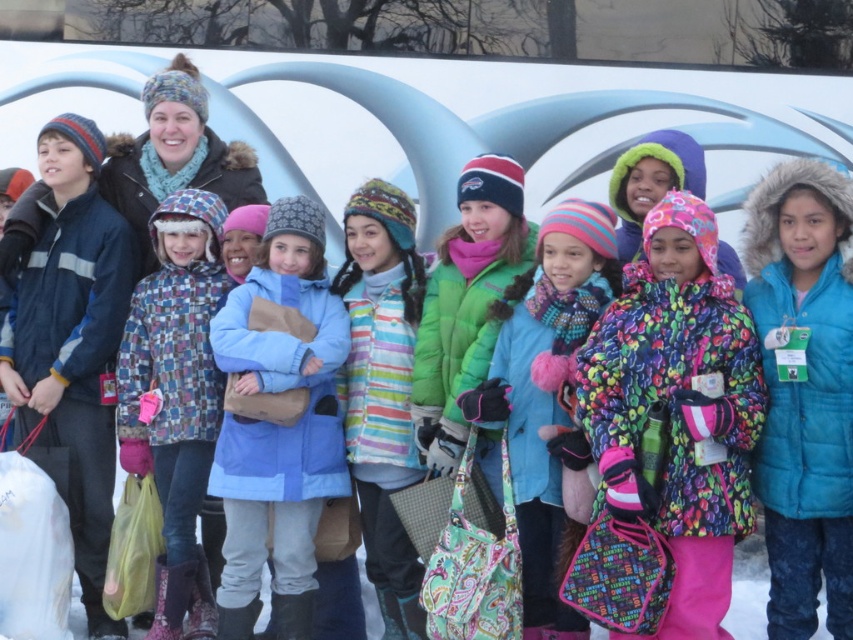
You are a photographer standing at the center of the snowy area. You want to take a photo of the multicolored fleece jacket at center. Where should you aim your camera?

You should aim your camera at point (676, 413) to capture the multicolored fleece jacket at center.

Looking at this image, you are a photographer trying to capture a photo of the plaid fabric coat at center and the striped fleece jacket at center. Since you want to ensure both are in focus, you need to know which one is taller. Which one is taller?

The plaid fabric coat at center is taller than the striped fleece jacket at center.